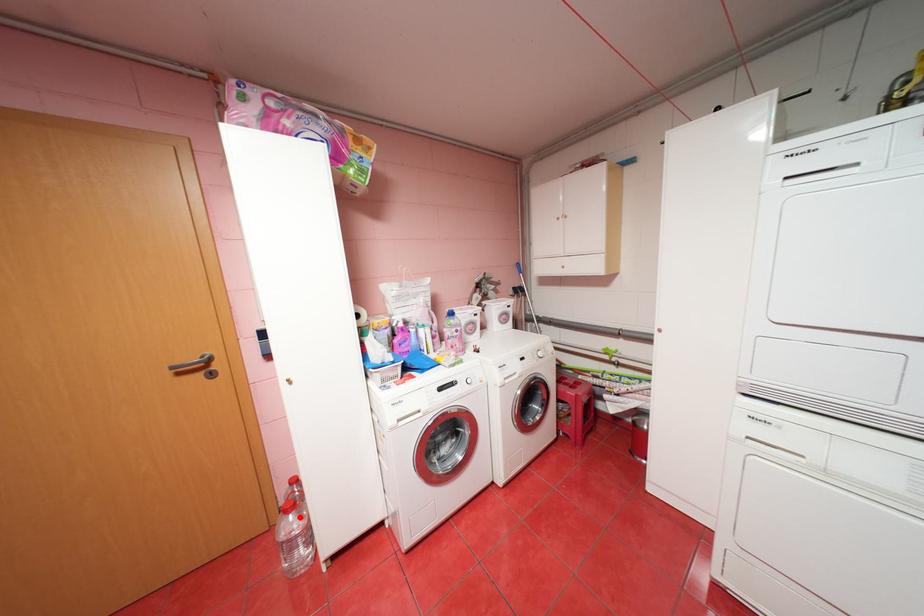
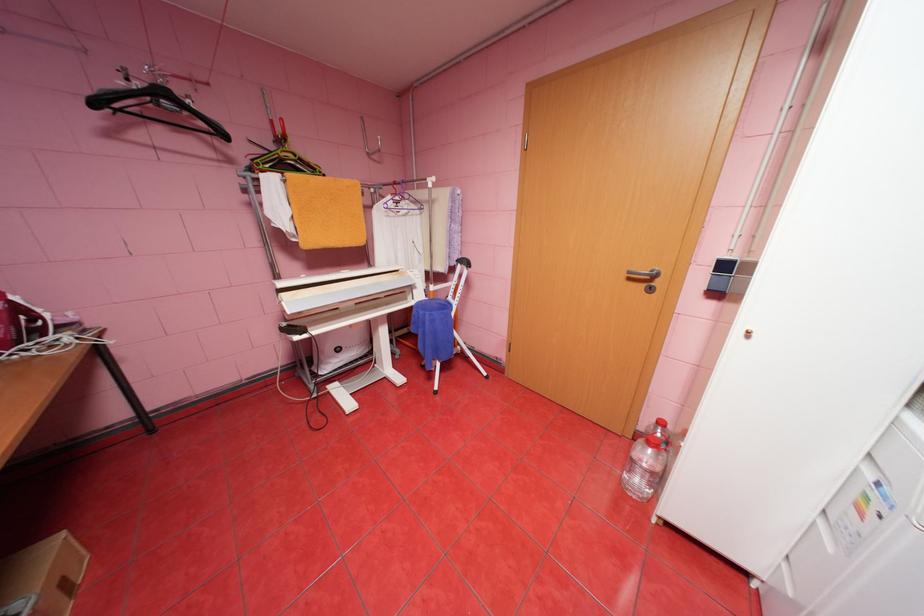
In the second image, find the point that corresponds to the highlighted location in the first image.

(659, 451)